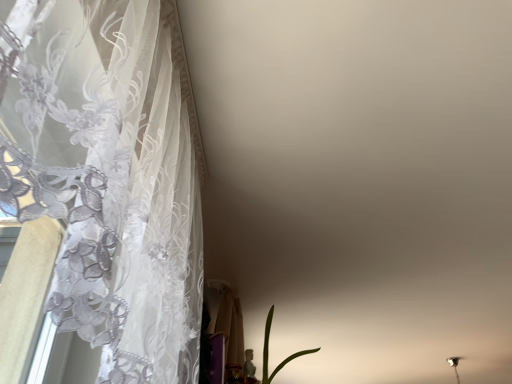
Identify the location of green leafy stem at lower center. This screenshot has height=384, width=512. (268, 351).

This screenshot has height=384, width=512. What do you see at coordinates (268, 351) in the screenshot?
I see `green leafy stem at lower center` at bounding box center [268, 351].

Locate an element on the screen. green leafy stem at lower center is located at coordinates (268, 351).